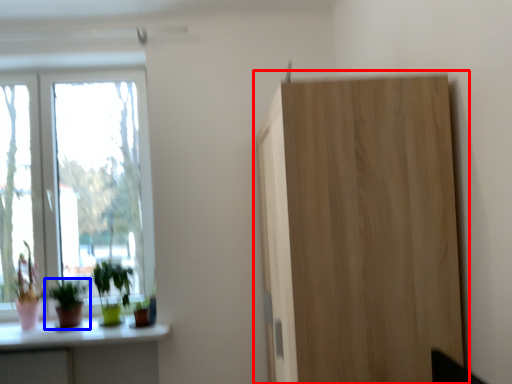
Question: Which point is closer to the camera, cupboard (highlighted by a red box) or houseplant (highlighted by a blue box)?

Choices:
 (A) cupboard
 (B) houseplant

Answer: (A)